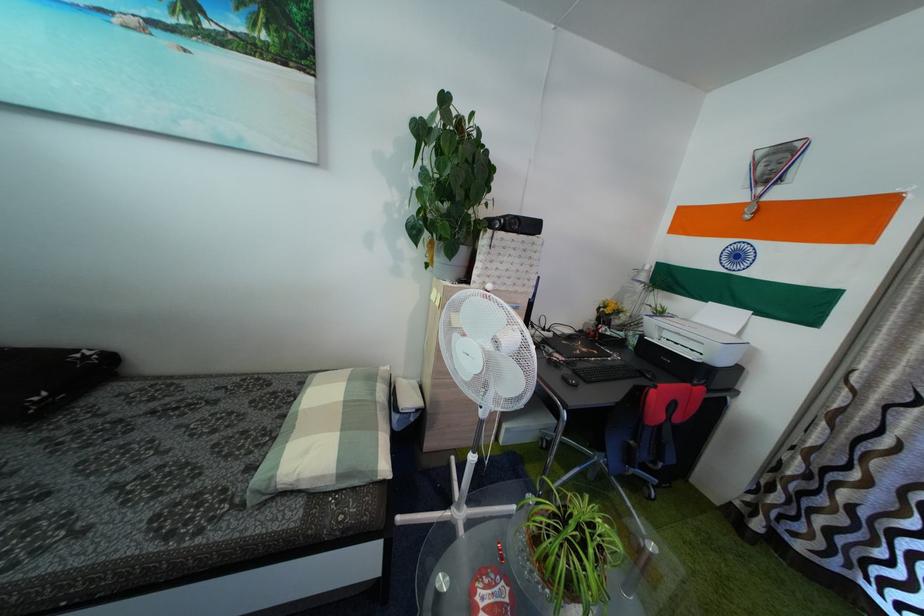
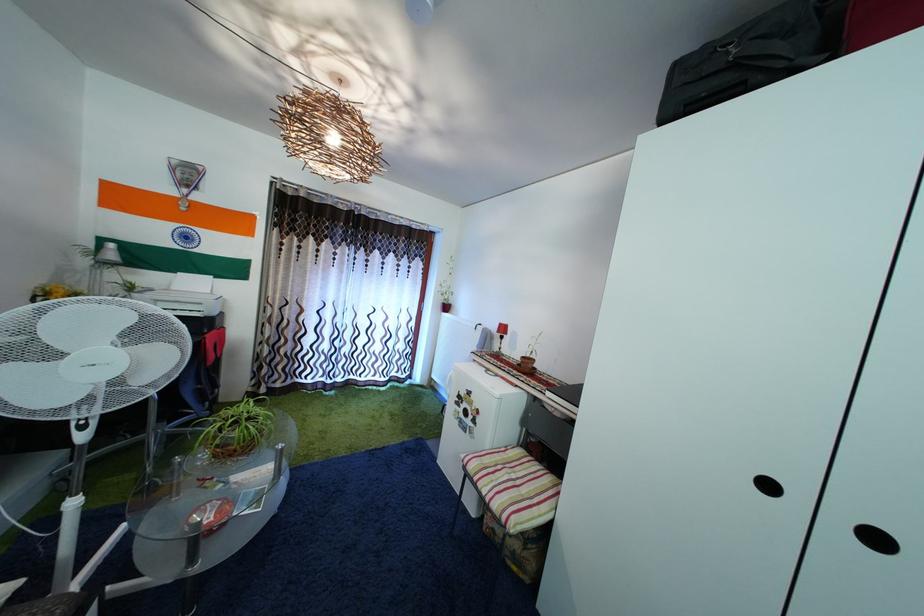
The first image is from the beginning of the video and the second image is from the end. How did the camera likely rotate when shooting the video?

The rotation direction of the camera is right-down.